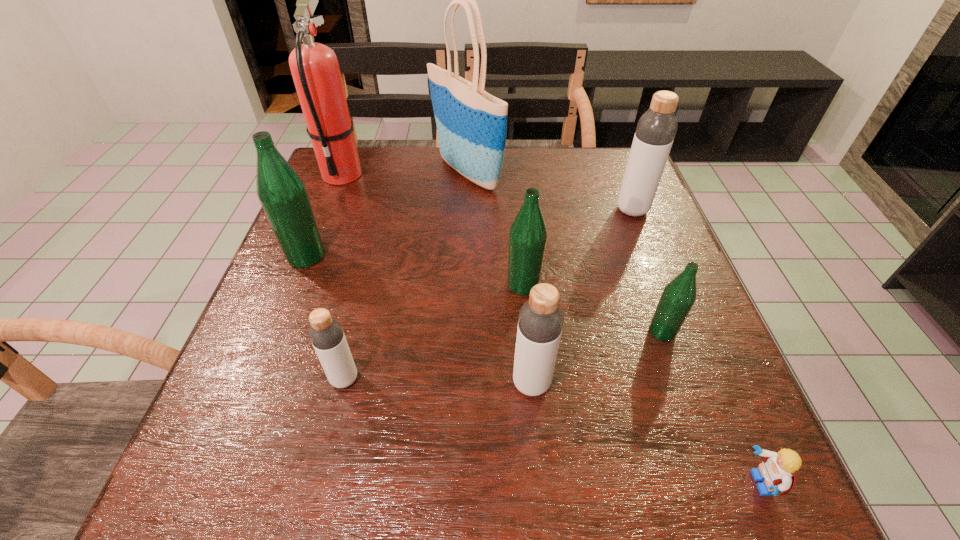
Select which object is the fourth closest to the second gray bottle from right to left. Please provide its 2D coordinates. Your answer should be formatted as a tuple, i.e. [(x, y)], where the tuple contains the x and y coordinates of a point satisfying the conditions above.

[(778, 470)]

Locate which bottle is the second closest to the fourth nearest bottle. Please provide its 2D coordinates. Your answer should be formatted as a tuple, i.e. [(x, y)], where the tuple contains the x and y coordinates of a point satisfying the conditions above.

[(678, 297)]

The width and height of the screenshot is (960, 540). I want to click on bottle that stands as the third closest to the leftmost gray bottle, so click(528, 233).

Select which gray bottle appears as the second closest to the fire extinguisher. Please provide its 2D coordinates. Your answer should be formatted as a tuple, i.e. [(x, y)], where the tuple contains the x and y coordinates of a point satisfying the conditions above.

[(540, 322)]

Find the location of a particular element. Image resolution: width=960 pixels, height=540 pixels. gray bottle that stands as the closest to the second gray bottle from left to right is located at coordinates (326, 334).

This screenshot has width=960, height=540. Identify the location of green bottle that is the second closest one to the blue tote bag. (283, 195).

The height and width of the screenshot is (540, 960). What are the coordinates of `green bottle that stands as the third closest to the tote bag` in the screenshot? It's located at (678, 297).

This screenshot has width=960, height=540. I want to click on free region that satisfies the following two spatial constraints: 1. on the hose direction of the fifth farthest object; 2. on the right side of the fire extinguisher, so click(x=300, y=285).

You are a GUI agent. You are given a task and a screenshot of the screen. Output one action in this format:
    pyautogui.click(x=<x>, y=<y>)
    Task: Click on the free space that satisfies the following two spatial constraints: 1. on the hose direction of the fire extinguisher; 2. on the left side of the seventh object from right to left
    This screenshot has height=540, width=960.
    Given the screenshot: What is the action you would take?
    pyautogui.click(x=263, y=379)